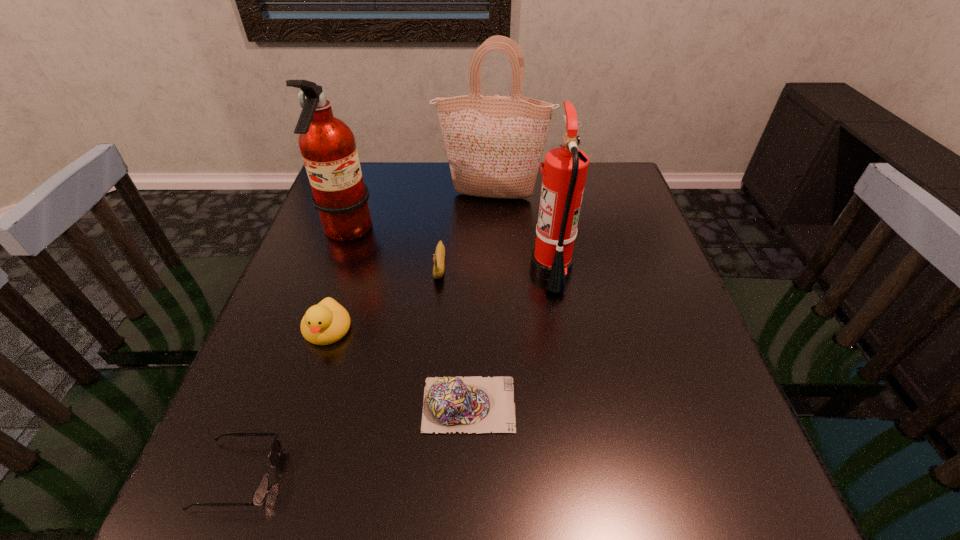
You are a GUI agent. You are given a task and a screenshot of the screen. Output one action in this format:
    pyautogui.click(x=<x>, y=<y>)
    Task: Click on the fire extinguisher present at the left edge
    
    Given the screenshot: What is the action you would take?
    pyautogui.click(x=328, y=147)

Where is `duckling present at the left edge`? duckling present at the left edge is located at coordinates (327, 322).

This screenshot has width=960, height=540. Find the location of `sunglasses that is positioned at the left edge`. sunglasses that is positioned at the left edge is located at coordinates (262, 489).

Where is `object that is at the near left corner`? object that is at the near left corner is located at coordinates (262, 489).

This screenshot has width=960, height=540. In the image, there is a desktop. Identify the location of vacant space at the near edge. (571, 496).

Find the location of a particular element. The height and width of the screenshot is (540, 960). vacant space at the left edge of the desktop is located at coordinates (248, 390).

The width and height of the screenshot is (960, 540). I want to click on vacant area at the right edge, so [610, 280].

This screenshot has height=540, width=960. In the image, there is a desktop. Find the location of `vacant space at the near left corner`. vacant space at the near left corner is located at coordinates (278, 487).

In order to click on vacant space that's between the sunglasses and the cap in this screenshot , I will do `click(353, 440)`.

Locate an element on the screen. This screenshot has height=540, width=960. empty space between the third nearest object and the banana is located at coordinates (384, 297).